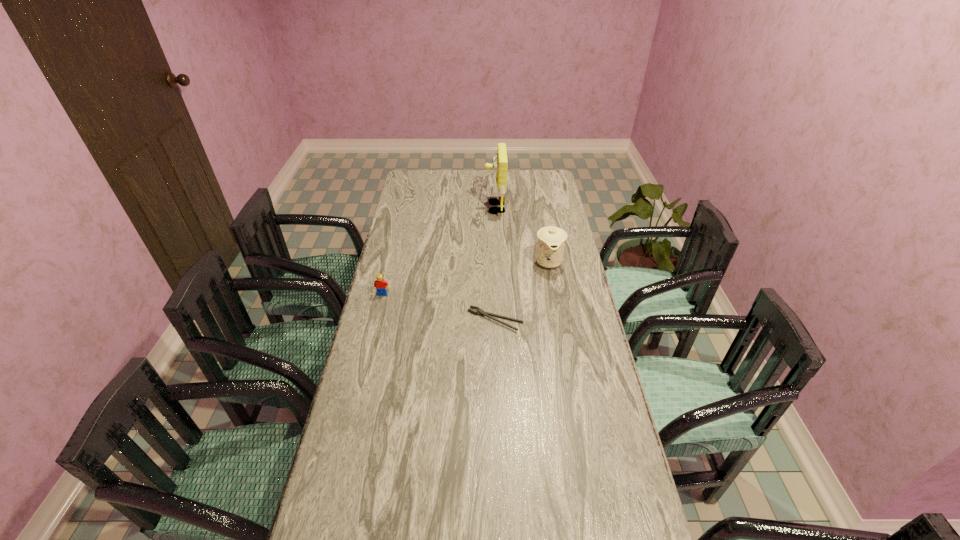
I want to click on free spot located on the face of the tallest object, so click(453, 208).

Find the location of `free region located on the spout of the chinaware`. free region located on the spout of the chinaware is located at coordinates (563, 336).

Image resolution: width=960 pixels, height=540 pixels. What are the coordinates of `vacant area situated 0.400m on the face of the second nearest object` in the screenshot? It's located at (360, 386).

Identify the location of free space located on the front of the shortest object. (496, 353).

Locate an element on the screen. The width and height of the screenshot is (960, 540). object that is at the left edge is located at coordinates (380, 284).

You are a GUI agent. You are given a task and a screenshot of the screen. Output one action in this format:
    pyautogui.click(x=<x>, y=<y>)
    Task: Click on the object positioned at the right edge
    The width and height of the screenshot is (960, 540).
    Given the screenshot: What is the action you would take?
    [551, 240]

At what (x,y) coordinates should I click in order to perform the action: click on free spot at the far edge of the desktop. Please return your answer as a coordinate pair (x, y). The image size is (960, 540). Looking at the image, I should click on (468, 191).

In the image, there is a desktop. Find the location of `vacant space at the left edge`. vacant space at the left edge is located at coordinates (402, 213).

Locate an element on the screen. The height and width of the screenshot is (540, 960). free region at the right edge of the desktop is located at coordinates (552, 215).

The height and width of the screenshot is (540, 960). Find the location of `free space at the far right corner`. free space at the far right corner is located at coordinates (528, 180).